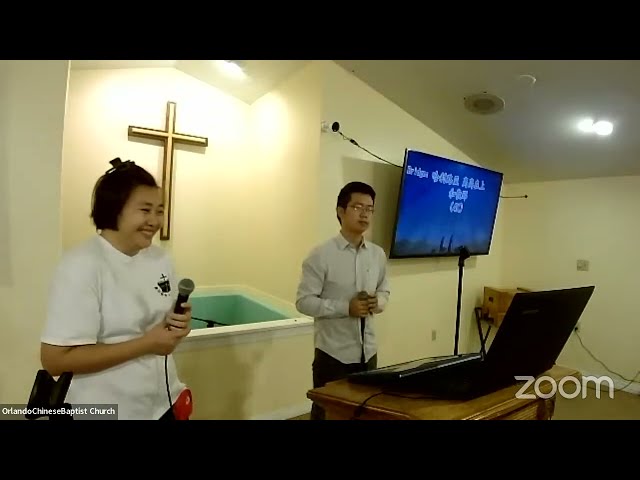
Where is `tv`? This screenshot has height=480, width=640. tv is located at coordinates (442, 194).